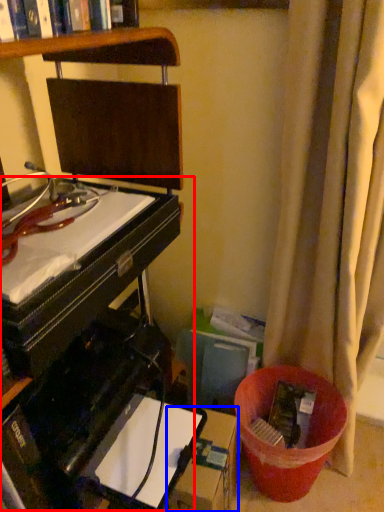
Question: Which point is further to the camera, computer desk (highlighted by a red box) or cardboard box (highlighted by a blue box)?

Choices:
 (A) computer desk
 (B) cardboard box

Answer: (B)